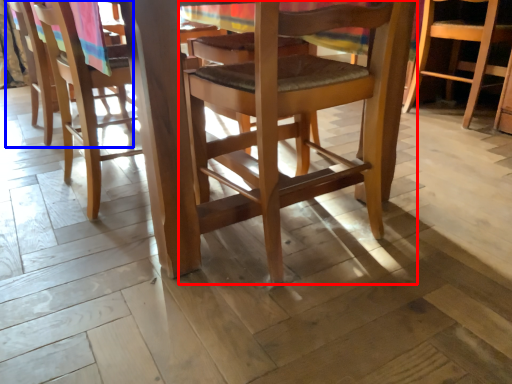
Question: Which of the following is the closest to the observer, chair (highlighted by a red box) or chair (highlighted by a blue box)?

Choices:
 (A) chair
 (B) chair

Answer: (A)